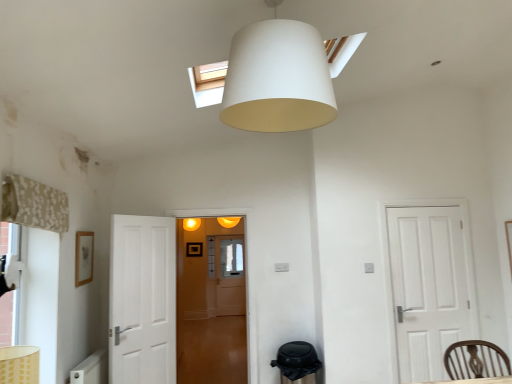
Question: From a real-world perspective, is beige floral fabric curtain at left physically above white matte lampshade at upper center?

Choices:
 (A) yes
 (B) no

Answer: (B)

Question: From the image's perspective, is beige floral fabric curtain at left on top of white matte lampshade at upper center?

Choices:
 (A) no
 (B) yes

Answer: (A)

Question: From the image's perspective, is beige floral fabric curtain at left located beneath white matte lampshade at upper center?

Choices:
 (A) no
 (B) yes

Answer: (B)

Question: Considering the relative sizes of beige floral fabric curtain at left and white matte lampshade at upper center in the image provided, is beige floral fabric curtain at left wider than white matte lampshade at upper center?

Choices:
 (A) yes
 (B) no

Answer: (B)

Question: Is beige floral fabric curtain at left taller than white matte lampshade at upper center?

Choices:
 (A) yes
 (B) no

Answer: (B)

Question: In the image, is beige floral fabric curtain at left positioned in front of or behind brown wooden chair at lower right?

Choices:
 (A) front
 (B) behind

Answer: (A)

Question: Visually, is beige floral fabric curtain at left positioned to the left or to the right of brown wooden chair at lower right?

Choices:
 (A) right
 (B) left

Answer: (B)

Question: Is beige floral fabric curtain at left spatially inside brown wooden chair at lower right, or outside of it?

Choices:
 (A) inside
 (B) outside

Answer: (B)

Question: From the image's perspective, is beige floral fabric curtain at left positioned above or below brown wooden chair at lower right?

Choices:
 (A) above
 (B) below

Answer: (A)

Question: From the image's perspective, is white matte door at right above or below translucent wooden door at center?

Choices:
 (A) below
 (B) above

Answer: (B)

Question: From a real-world perspective, is white matte door at right physically located above or below translucent wooden door at center?

Choices:
 (A) above
 (B) below

Answer: (B)

Question: Is white matte door at right wider or thinner than translucent wooden door at center?

Choices:
 (A) thin
 (B) wide

Answer: (A)

Question: Would you say white matte door at right is inside or outside translucent wooden door at center?

Choices:
 (A) outside
 (B) inside

Answer: (A)

Question: From a real-world perspective, is beige floral fabric curtain at left above or below translucent wooden door at center?

Choices:
 (A) below
 (B) above

Answer: (B)

Question: Is beige floral fabric curtain at left bigger or smaller than translucent wooden door at center?

Choices:
 (A) big
 (B) small

Answer: (B)